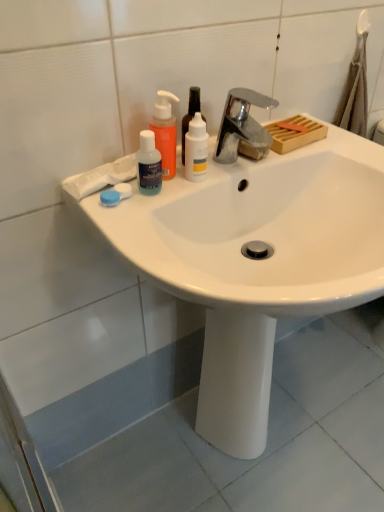
Where is `blue plastic contact lens case at left`? This screenshot has height=512, width=384. blue plastic contact lens case at left is located at coordinates (115, 194).

Consider the image. Measure the distance between point (261, 324) and camera.

The distance of point (261, 324) from camera is 34.49 inches.

This screenshot has width=384, height=512. I want to click on white glossy sink at center, so click(256, 261).

In order to face translucent plastic mouthwash at upper left, positioned as the 3th mouthwash in right-to-left order, should I rotate leftwards or rightwards?

Rotate left and turn 5.955 degrees.

The width and height of the screenshot is (384, 512). I want to click on chrome metallic faucet at upper center, so click(242, 127).

Image resolution: width=384 pixels, height=512 pixels. What do you see at coordinates (165, 132) in the screenshot? I see `translucent orange pump bottle at upper left` at bounding box center [165, 132].

What is the approximate width of white glossy bottle at center, marked as the 2th mouthwash in a left-to-right arrangement?

The width of white glossy bottle at center, marked as the 2th mouthwash in a left-to-right arrangement, is 1.88 inches.

Where is `blue plastic contact lens case at left`? blue plastic contact lens case at left is located at coordinates (115, 194).

From the image's perspective, which one is positioned lower, translucent orange pump bottle at upper left or white glossy sink at center?

white glossy sink at center.

From a real-world perspective, is translucent orange pump bottle at upper left beneath white glossy sink at center?

No, from a real-world perspective, translucent orange pump bottle at upper left is not below white glossy sink at center.

Which is closer, (x=173, y=152) or (x=314, y=246)?

The point (x=173, y=152) is closer.

Is translucent orange pump bottle at upper left in front of white glossy sink at center?

No, translucent orange pump bottle at upper left is behind white glossy sink at center.

Could translucent orange pump bottle at upper left be considered to be inside white glossy sink at center?

That's incorrect, translucent orange pump bottle at upper left is not inside white glossy sink at center.

Is white glossy sink at center turned away from translucent orange pump bottle at upper left?

No, white glossy sink at center's orientation is not away from translucent orange pump bottle at upper left.

Are white glossy sink at center and translucent orange pump bottle at upper left beside each other?

There is a gap between white glossy sink at center and translucent orange pump bottle at upper left.

From the picture: How different are the orientations of white glossy sink at center and translucent orange pump bottle at upper left in degrees?

There is a 7.24-degree angle between the facing directions of white glossy sink at center and translucent orange pump bottle at upper left.

Who is bigger, white glossy bottle at center, the second mouthwash when ordered from right to left, or white glossy sink at center?

white glossy sink at center is bigger.

Based on their positions, is white glossy bottle at center, marked as the 2th mouthwash in a left-to-right arrangement, located to the left or right of white glossy sink at center?

From the image, it's evident that white glossy bottle at center, marked as the 2th mouthwash in a left-to-right arrangement, is to the left of white glossy sink at center.

Is white glossy bottle at center, the second mouthwash when ordered from right to left, surrounding white glossy sink at center?

No, white glossy sink at center is not a part of white glossy bottle at center, the second mouthwash when ordered from right to left.

Considering their positions, is white glossy bottle at center, marked as the 2th mouthwash in a left-to-right arrangement, located in front of or behind white glossy sink at center?

white glossy bottle at center, marked as the 2th mouthwash in a left-to-right arrangement, is positioned farther from the viewer than white glossy sink at center.

From a real-world perspective, is translucent plastic mouthwash at upper left, arranged as the first mouthwash when viewed from the left, over white glossy sink at center?

Yes.

From the image's perspective, is translucent plastic mouthwash at upper left, positioned as the 3th mouthwash in right-to-left order, located beneath white glossy sink at center?

No.

Is translucent plastic mouthwash at upper left, arranged as the first mouthwash when viewed from the left, to the left of white glossy sink at center from the viewer's perspective?

Yes, translucent plastic mouthwash at upper left, arranged as the first mouthwash when viewed from the left, is to the left of white glossy sink at center.

How far apart are translucent plastic mouthwash at upper left, positioned as the 3th mouthwash in right-to-left order, and white glossy sink at center?

A distance of 12.77 inches exists between translucent plastic mouthwash at upper left, positioned as the 3th mouthwash in right-to-left order, and white glossy sink at center.

Between chrome metallic faucet at upper center and white glossy bottle at center, the second mouthwash when ordered from right to left, which one has less height?

With less height is chrome metallic faucet at upper center.

Does chrome metallic faucet at upper center have a greater width compared to white glossy bottle at center, the second mouthwash when ordered from right to left?

Indeed, chrome metallic faucet at upper center has a greater width compared to white glossy bottle at center, the second mouthwash when ordered from right to left.

Between chrome metallic faucet at upper center and white glossy bottle at center, the second mouthwash when ordered from right to left, which one is positioned in front?

chrome metallic faucet at upper center is in front.

Does point (170, 147) lie behind point (193, 97)?

No, (170, 147) is closer to viewer.

Based on their positions, is translucent orange pump bottle at upper left located to the left or right of white glossy bottle at center, the second mouthwash when ordered from right to left?

translucent orange pump bottle at upper left is to the left of white glossy bottle at center, the second mouthwash when ordered from right to left.

Can you tell me how much translucent orange pump bottle at upper left and white glossy bottle at center, marked as the 2th mouthwash in a left-to-right arrangement, differ in facing direction?

The facing directions of translucent orange pump bottle at upper left and white glossy bottle at center, marked as the 2th mouthwash in a left-to-right arrangement, are 0.000123 degrees apart.

From the image's perspective, which object appears higher, translucent orange pump bottle at upper left or white glossy bottle at center, the second mouthwash when ordered from right to left?

white glossy bottle at center, the second mouthwash when ordered from right to left.

Would you say white glossy bottle at center, the second mouthwash when ordered from right to left, is part of blue plastic contact lens case at left's contents?

No, white glossy bottle at center, the second mouthwash when ordered from right to left, is not inside blue plastic contact lens case at left.

Which of these two, blue plastic contact lens case at left or white glossy bottle at center, marked as the 2th mouthwash in a left-to-right arrangement, is smaller?

With smaller size is blue plastic contact lens case at left.

Between blue plastic contact lens case at left and white glossy bottle at center, marked as the 2th mouthwash in a left-to-right arrangement, which one has smaller width?

With smaller width is blue plastic contact lens case at left.

Is blue plastic contact lens case at left next to white glossy bottle at center, marked as the 2th mouthwash in a left-to-right arrangement, and touching it?

No.

In order to click on sink lying below the translucent orange pump bottle at upper left (from the image's perspective) in this screenshot , I will do click(x=256, y=261).

I want to click on cleaning product located above the white glossy sink at center (from the image's perspective), so click(165, 132).

Estimate the real-world distances between objects in this image. Which object is further from white glossy bottle at center, the second mouthwash when ordered from right to left, white glossy sink at center or chrome metallic faucet at upper center?

The object further to white glossy bottle at center, the second mouthwash when ordered from right to left, is white glossy sink at center.

Based on their spatial positions, is white glossy sink at center or translucent orange pump bottle at upper left closer to white glossy bottle at center, marked as the 2th mouthwash in a left-to-right arrangement?

translucent orange pump bottle at upper left lies closer to white glossy bottle at center, marked as the 2th mouthwash in a left-to-right arrangement, than the other object.

Based on their spatial positions, is chrome metallic faucet at upper center or white glossy bottle at center, the second mouthwash when ordered from right to left, further from blue plastic contact lens case at left?

chrome metallic faucet at upper center lies further to blue plastic contact lens case at left than the other object.

Which object lies further to the anchor point white glossy sink at center, white glossy bottle at center, the second mouthwash when ordered from right to left, or white glossy bottle at center, the third mouthwash in the left-to-right sequence?

white glossy bottle at center, the second mouthwash when ordered from right to left, is further to white glossy sink at center.

Looking at the image, which one is located further to chrome metallic faucet at upper center, white glossy bottle at center, the second mouthwash when ordered from right to left, or translucent plastic mouthwash at upper left, positioned as the 3th mouthwash in right-to-left order?

translucent plastic mouthwash at upper left, positioned as the 3th mouthwash in right-to-left order, is further to chrome metallic faucet at upper center.

Based on their spatial positions, is chrome metallic faucet at upper center or translucent plastic mouthwash at upper left, arranged as the first mouthwash when viewed from the left, closer to white glossy sink at center?

chrome metallic faucet at upper center lies closer to white glossy sink at center than the other object.

Considering their positions, is translucent plastic mouthwash at upper left, arranged as the first mouthwash when viewed from the left, positioned further to white glossy sink at center than blue plastic contact lens case at left?

blue plastic contact lens case at left is positioned further to the anchor white glossy sink at center.

When comparing their distances from white glossy sink at center, does translucent orange pump bottle at upper left or blue plastic contact lens case at left seem closer?

translucent orange pump bottle at upper left is positioned closer to the anchor white glossy sink at center.

At what (x,y) coordinates should I click in order to perform the action: click on cleaning product between white glossy bottle at center, marked as the 2th mouthwash in a left-to-right arrangement, and translucent plastic mouthwash at upper left, positioned as the 3th mouthwash in right-to-left order, from top to bottom. Please return your answer as a coordinate pair (x, y). Image resolution: width=384 pixels, height=512 pixels. Looking at the image, I should click on (165, 132).

The image size is (384, 512). I want to click on mouthwash positioned between white glossy sink at center and white glossy bottle at center, the third mouthwash in the left-to-right sequence, from near to far, so click(148, 165).

The width and height of the screenshot is (384, 512). I want to click on tap located between white glossy sink at center and white glossy bottle at center, arranged as the first mouthwash when viewed from the right, in the depth direction, so click(242, 127).

This screenshot has width=384, height=512. I want to click on cleaning product between translucent plastic mouthwash at upper left, positioned as the 3th mouthwash in right-to-left order, and chrome metallic faucet at upper center from left to right, so click(x=165, y=132).